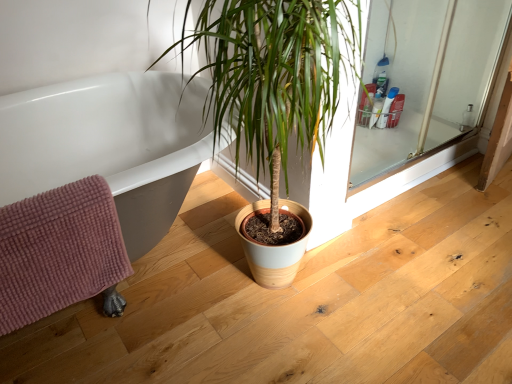
Question: Would you say pink textured bath towel at lower left is a long distance from clear glass screen door at upper right?

Choices:
 (A) yes
 (B) no

Answer: (A)

Question: Is pink textured bath towel at lower left taller than clear glass screen door at upper right?

Choices:
 (A) yes
 (B) no

Answer: (B)

Question: From the image's perspective, does pink textured bath towel at lower left appear lower than clear glass screen door at upper right?

Choices:
 (A) yes
 (B) no

Answer: (A)

Question: Can you confirm if pink textured bath towel at lower left is thinner than clear glass screen door at upper right?

Choices:
 (A) no
 (B) yes

Answer: (A)

Question: From the image's perspective, does pink textured bath towel at lower left appear higher than clear glass screen door at upper right?

Choices:
 (A) yes
 (B) no

Answer: (B)

Question: Is pink textured bath towel at lower left completely or partially outside of clear glass screen door at upper right?

Choices:
 (A) yes
 (B) no

Answer: (A)

Question: Is pink textured bath towel at lower left inside clear glass screen door at upper right?

Choices:
 (A) no
 (B) yes

Answer: (A)

Question: Would you consider clear glass screen door at upper right to be distant from pink textured bath towel at lower left?

Choices:
 (A) yes
 (B) no

Answer: (A)

Question: Does clear glass screen door at upper right lie in front of pink textured bath towel at lower left?

Choices:
 (A) no
 (B) yes

Answer: (A)

Question: Does clear glass screen door at upper right have a smaller size compared to pink textured bath towel at lower left?

Choices:
 (A) no
 (B) yes

Answer: (A)

Question: From a real-world perspective, is clear glass screen door at upper right physically above pink textured bath towel at lower left?

Choices:
 (A) yes
 (B) no

Answer: (B)

Question: Does clear glass screen door at upper right appear on the right side of pink textured bath towel at lower left?

Choices:
 (A) no
 (B) yes

Answer: (B)

Question: Considering the positions of pink textured bath towel at lower left and clear glass screen door at upper right in the image, is pink textured bath towel at lower left wider or thinner than clear glass screen door at upper right?

Choices:
 (A) thin
 (B) wide

Answer: (B)